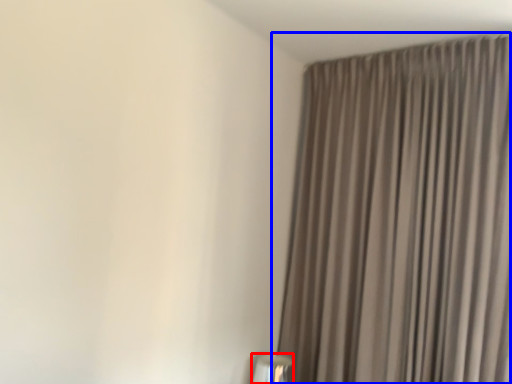
Question: Which object appears closest to the camera in this image, table lamp (highlighted by a red box) or curtain (highlighted by a blue box)?

Choices:
 (A) table lamp
 (B) curtain

Answer: (B)